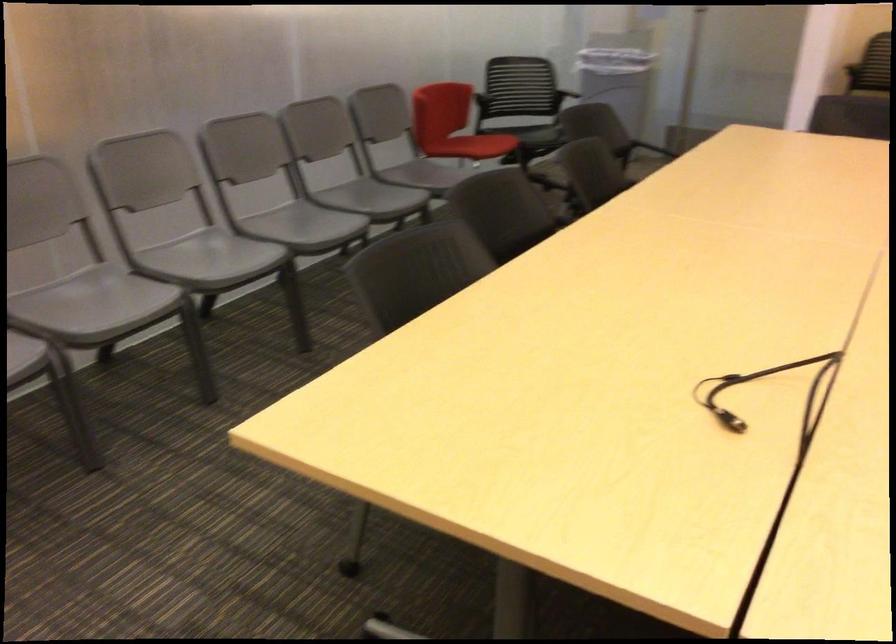
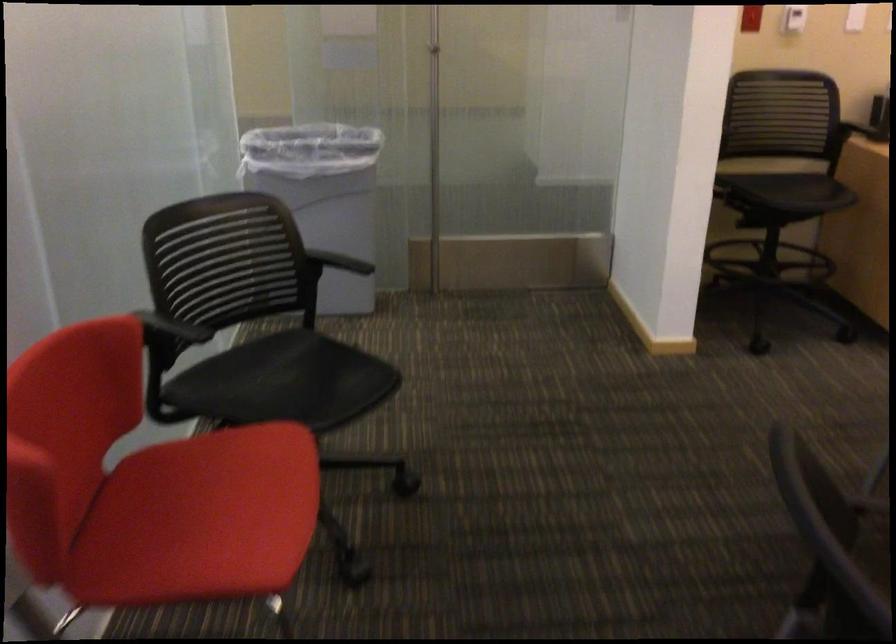
Locate, in the second image, the point that corresponds to (x=481, y=142) in the first image.

(200, 518)